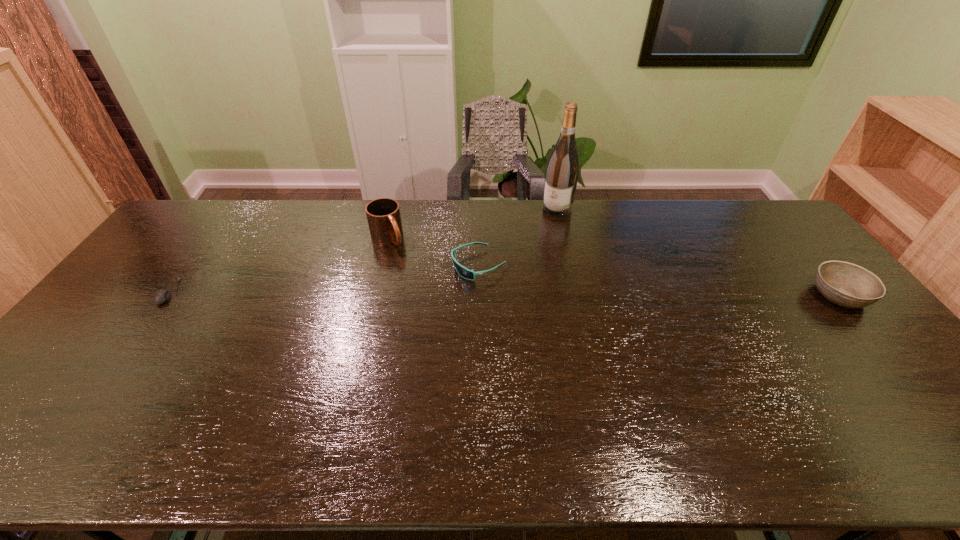
I want to click on vacant space located 0.320m on the front of the leftmost object, so click(86, 406).

Find the location of a particular element. vacant area situated 0.360m on the left of the bowl is located at coordinates (690, 295).

Where is `free location located 0.110m on the front-facing side of the third object from left to right`? free location located 0.110m on the front-facing side of the third object from left to right is located at coordinates (423, 287).

In order to click on free region located 0.120m on the front-facing side of the third object from left to right in this screenshot , I will do `click(420, 288)`.

The height and width of the screenshot is (540, 960). In order to click on vacant region located 0.150m on the front-facing side of the third object from left to right in this screenshot , I will do `click(412, 292)`.

Find the location of a particular element. The height and width of the screenshot is (540, 960). vacant space located 0.250m on the side of the mug with the handle is located at coordinates (432, 293).

You are a GUI agent. You are given a task and a screenshot of the screen. Output one action in this format:
    pyautogui.click(x=<x>, y=<y>)
    Task: Click on the vacant space located 0.340m on the side of the mug with the handle
    Image resolution: width=960 pixels, height=540 pixels.
    Given the screenshot: What is the action you would take?
    pyautogui.click(x=447, y=312)

You are a GUI agent. You are given a task and a screenshot of the screen. Output one action in this format:
    pyautogui.click(x=<x>, y=<y>)
    Task: Click on the vacant space located 0.310m on the side of the mug with the handle
    Image resolution: width=960 pixels, height=540 pixels.
    Given the screenshot: What is the action you would take?
    pyautogui.click(x=442, y=305)

Where is `free space located 0.120m on the label of the fourth object from left to right`? The height and width of the screenshot is (540, 960). free space located 0.120m on the label of the fourth object from left to right is located at coordinates (538, 234).

The width and height of the screenshot is (960, 540). Identify the location of vacant space located on the label of the fourth object from left to right. (546, 223).